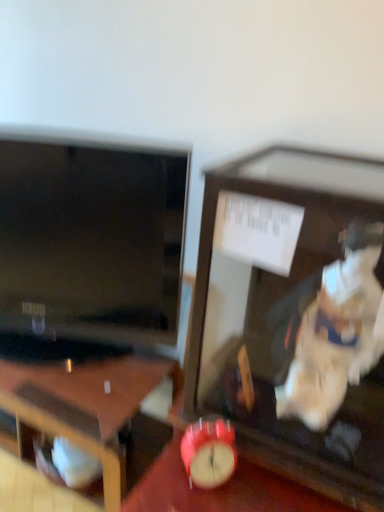
Find the location of a particular element. The width and height of the screenshot is (384, 512). free region under matte black tv at left (from a real-world perspective) is located at coordinates (88, 362).